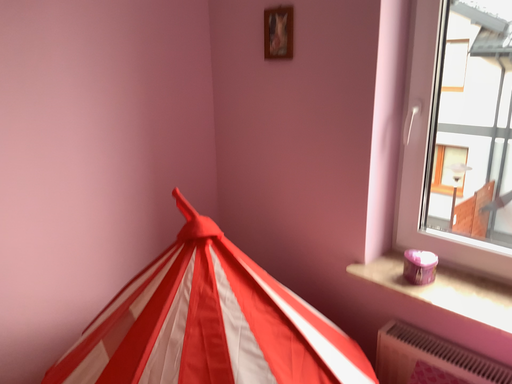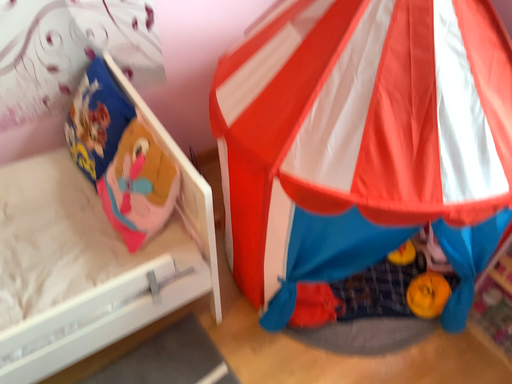
Question: Which way did the camera rotate in the video?

Choices:
 (A) rotated downward
 (B) rotated upward

Answer: (A)